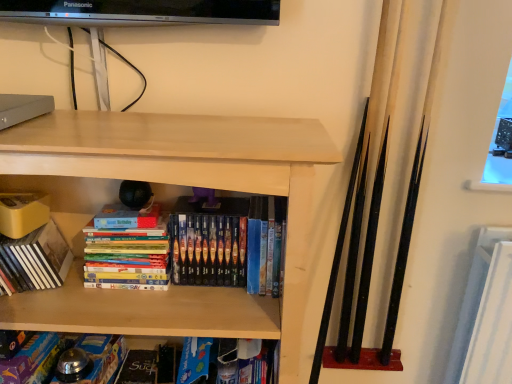
Question: Is hardcover books at center, which appears as the 1th book when viewed from the right, closer to camera compared to matte yellow book at left, arranged as the 1th book when viewed from the left?

Choices:
 (A) yes
 (B) no

Answer: (B)

Question: Is hardcover books at center, which is counted as the 4th book, starting from the left, at the right side of matte yellow book at left, which is counted as the fourth book, starting from the right?

Choices:
 (A) yes
 (B) no

Answer: (A)

Question: Is hardcover books at center, which appears as the 1th book when viewed from the right, behind matte yellow book at left, which is counted as the fourth book, starting from the right?

Choices:
 (A) yes
 (B) no

Answer: (A)

Question: Does hardcover books at center, which is counted as the 4th book, starting from the left, have a lesser width compared to matte yellow book at left, which is counted as the fourth book, starting from the right?

Choices:
 (A) yes
 (B) no

Answer: (A)

Question: From a real-world perspective, is hardcover books at center, which appears as the 1th book when viewed from the right, below matte yellow book at left, which is counted as the fourth book, starting from the right?

Choices:
 (A) no
 (B) yes

Answer: (A)

Question: From the image's perspective, is blue cardboard book at lower center, the third book positioned from the right, positioned above or below light wood shelf at center?

Choices:
 (A) below
 (B) above

Answer: (A)

Question: In terms of size, does blue cardboard book at lower center, the third book positioned from the right, appear bigger or smaller than light wood shelf at center?

Choices:
 (A) big
 (B) small

Answer: (B)

Question: Is blue cardboard book at lower center, the third book positioned from the right, to the left or to the right of light wood shelf at center in the image?

Choices:
 (A) left
 (B) right

Answer: (A)

Question: From a real-world perspective, relative to light wood shelf at center, is blue cardboard book at lower center, arranged as the 2th book when viewed from the left, vertically above or below?

Choices:
 (A) above
 (B) below

Answer: (B)

Question: In the image, is matte black paperback book at lower center positioned in front of or behind matte yellow book at left, which is counted as the fourth book, starting from the right?

Choices:
 (A) front
 (B) behind

Answer: (B)

Question: Is matte black paperback book at lower center taller or shorter than matte yellow book at left, arranged as the 1th book when viewed from the left?

Choices:
 (A) tall
 (B) short

Answer: (B)

Question: From a real-world perspective, is matte black paperback book at lower center above or below matte yellow book at left, arranged as the 1th book when viewed from the left?

Choices:
 (A) below
 (B) above

Answer: (A)

Question: Would you say matte black paperback book at lower center is inside or outside matte yellow book at left, which is counted as the fourth book, starting from the right?

Choices:
 (A) outside
 (B) inside

Answer: (A)

Question: Do you think light wood shelf at center is within multicolored cardboard books at center, placed as the third book when sorted from left to right, or outside of it?

Choices:
 (A) inside
 (B) outside

Answer: (B)

Question: From the image's perspective, relative to multicolored cardboard books at center, which is the 2th book in right-to-left order, is light wood shelf at center above or below?

Choices:
 (A) above
 (B) below

Answer: (B)